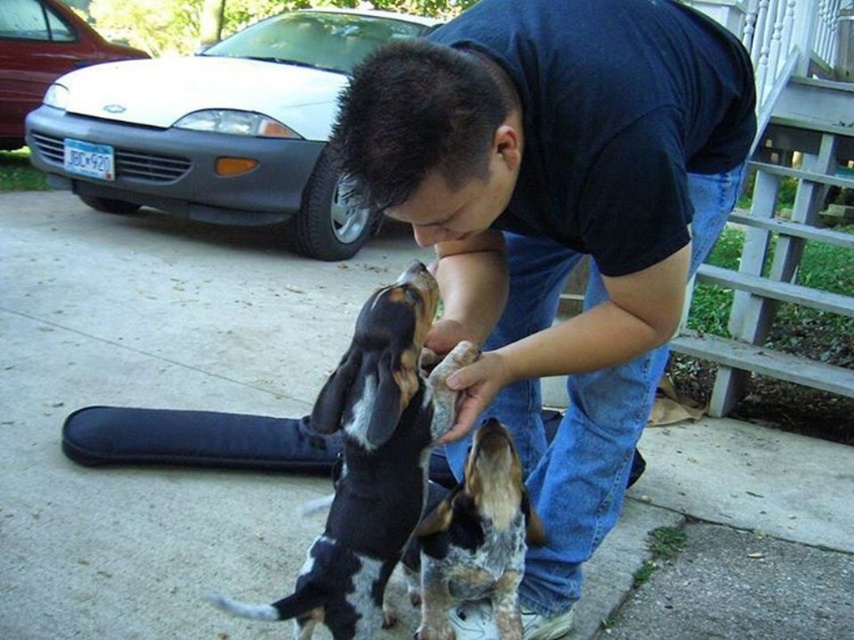
Can you confirm if black and white fur dog at center is bigger than spotted fur dog at center?

Indeed, black and white fur dog at center has a larger size compared to spotted fur dog at center.

Who is taller, black and white fur dog at center or spotted fur dog at center?

black and white fur dog at center

The height and width of the screenshot is (640, 854). Describe the element at coordinates (371, 461) in the screenshot. I see `black and white fur dog at center` at that location.

At what (x,y) coordinates should I click in order to perform the action: click on black and white fur dog at center. Please return your answer as a coordinate pair (x, y). The width and height of the screenshot is (854, 640). Looking at the image, I should click on (371, 461).

Is black cotton shirt at center wider than spotted fur dog at center?

Indeed, black cotton shirt at center has a greater width compared to spotted fur dog at center.

Who is more distant from viewer, (688, 134) or (524, 497)?

The point (524, 497) is more distant.

The width and height of the screenshot is (854, 640). I want to click on black cotton shirt at center, so click(x=557, y=224).

Who is more forward, (x=528, y=390) or (x=430, y=403)?

Point (x=430, y=403) is more forward.

Which is more to the left, black cotton shirt at center or black and white fur dog at center?

black and white fur dog at center

Does point (540, 248) lie behind point (410, 308)?

Yes, point (540, 248) is farther from viewer.

This screenshot has height=640, width=854. In order to click on black cotton shirt at center in this screenshot , I will do `click(557, 224)`.